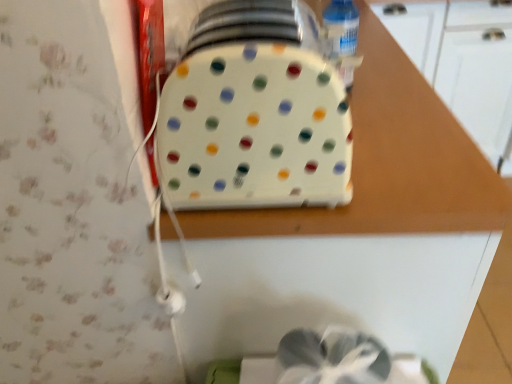
Question: Considering the relative sizes of clear plastic bottle at upper right and white plastic tray at center in the image provided, is clear plastic bottle at upper right smaller than white plastic tray at center?

Choices:
 (A) no
 (B) yes

Answer: (B)

Question: Can you confirm if clear plastic bottle at upper right is positioned to the left of white plastic tray at center?

Choices:
 (A) no
 (B) yes

Answer: (A)

Question: Considering the relative positions of clear plastic bottle at upper right and white plastic tray at center in the image provided, is clear plastic bottle at upper right to the right of white plastic tray at center from the viewer's perspective?

Choices:
 (A) no
 (B) yes

Answer: (B)

Question: From a real-world perspective, is clear plastic bottle at upper right beneath white plastic tray at center?

Choices:
 (A) yes
 (B) no

Answer: (B)

Question: From the image's perspective, does clear plastic bottle at upper right appear higher than white plastic tray at center?

Choices:
 (A) yes
 (B) no

Answer: (A)

Question: Is white plastic tray at center in front of or behind clear plastic bottle at upper right in the image?

Choices:
 (A) behind
 (B) front

Answer: (B)

Question: Considering the positions of white plastic tray at center and clear plastic bottle at upper right in the image, is white plastic tray at center taller or shorter than clear plastic bottle at upper right?

Choices:
 (A) tall
 (B) short

Answer: (A)

Question: Considering the positions of white plastic tray at center and clear plastic bottle at upper right in the image, is white plastic tray at center wider or thinner than clear plastic bottle at upper right?

Choices:
 (A) wide
 (B) thin

Answer: (A)

Question: Is white plastic tray at center to the left or to the right of clear plastic bottle at upper right in the image?

Choices:
 (A) left
 (B) right

Answer: (A)

Question: Considering the positions of white plastic toaster at center and clear plastic bottle at upper right in the image, is white plastic toaster at center taller or shorter than clear plastic bottle at upper right?

Choices:
 (A) tall
 (B) short

Answer: (A)

Question: Looking at their shapes, would you say white plastic toaster at center is wider or thinner than clear plastic bottle at upper right?

Choices:
 (A) wide
 (B) thin

Answer: (A)

Question: Considering the positions of white plastic toaster at center and clear plastic bottle at upper right in the image, is white plastic toaster at center bigger or smaller than clear plastic bottle at upper right?

Choices:
 (A) small
 (B) big

Answer: (B)

Question: Do you think white plastic toaster at center is within clear plastic bottle at upper right, or outside of it?

Choices:
 (A) inside
 (B) outside

Answer: (B)

Question: Considering the positions of point (351, 86) and point (329, 274), is point (351, 86) closer or farther from the camera than point (329, 274)?

Choices:
 (A) closer
 (B) farther

Answer: (B)

Question: From the image's perspective, is clear plastic bottle at upper right above or below white plastic tray at center?

Choices:
 (A) above
 (B) below

Answer: (A)